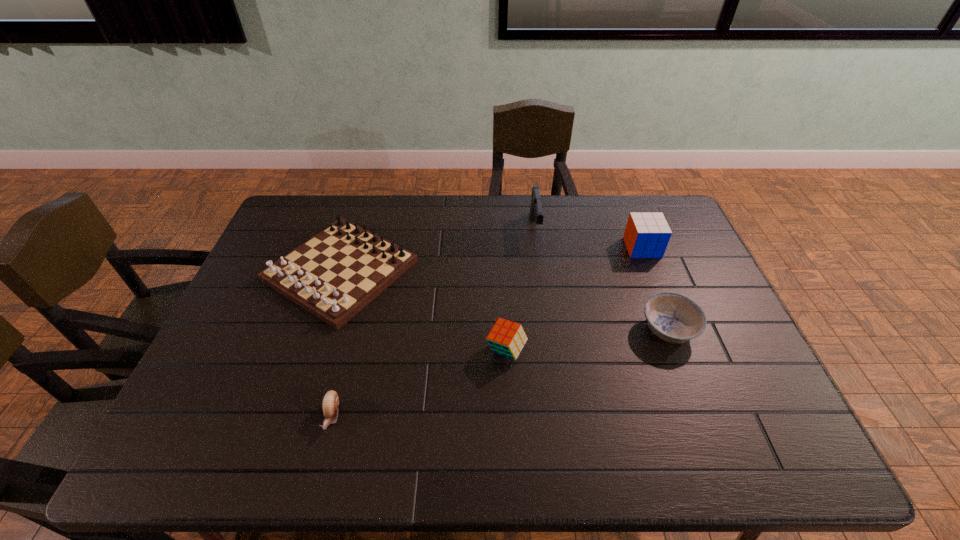
This screenshot has width=960, height=540. What are the coordinates of `blank space located on the left of the right cube` in the screenshot? It's located at (551, 247).

Identify the location of free location located on the back of the left cube. (504, 305).

This screenshot has height=540, width=960. I want to click on free space located on the right of the fourth tallest object, so click(x=517, y=271).

The image size is (960, 540). Identify the location of vacant point located 0.280m on the back of the bowl. (636, 245).

Where is `pistol at the far edge`? pistol at the far edge is located at coordinates (536, 213).

Find the location of a particular element. Image resolution: width=960 pixels, height=540 pixels. chessboard that is at the far edge is located at coordinates (335, 274).

Locate an element on the screen. The image size is (960, 540). object at the near edge is located at coordinates (330, 403).

The width and height of the screenshot is (960, 540). Identify the location of object that is at the left edge. (335, 274).

Image resolution: width=960 pixels, height=540 pixels. In order to click on cube that is at the right edge in this screenshot , I will do `click(647, 234)`.

At what (x,y) coordinates should I click in order to perform the action: click on bowl positioned at the right edge. Please return your answer as a coordinate pair (x, y). Looking at the image, I should click on (672, 317).